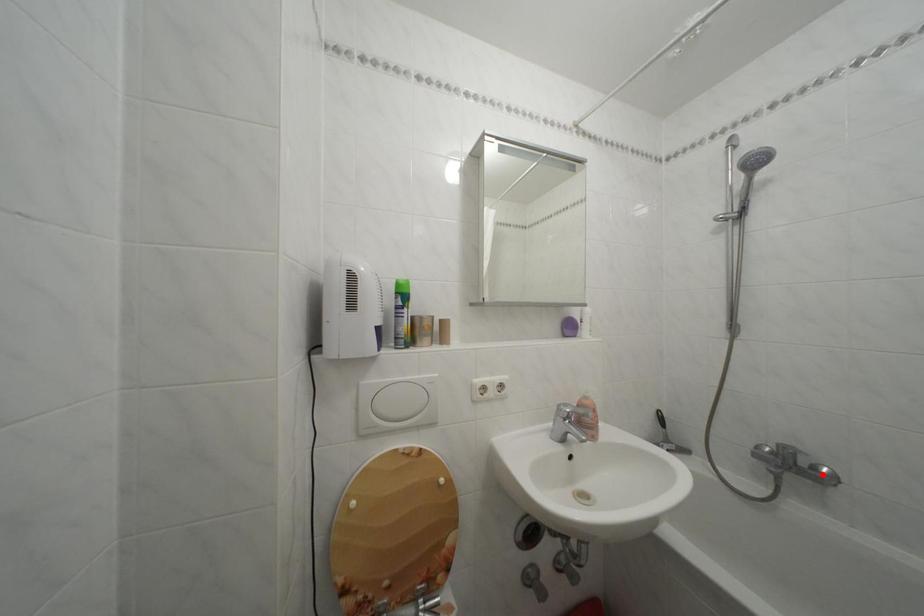
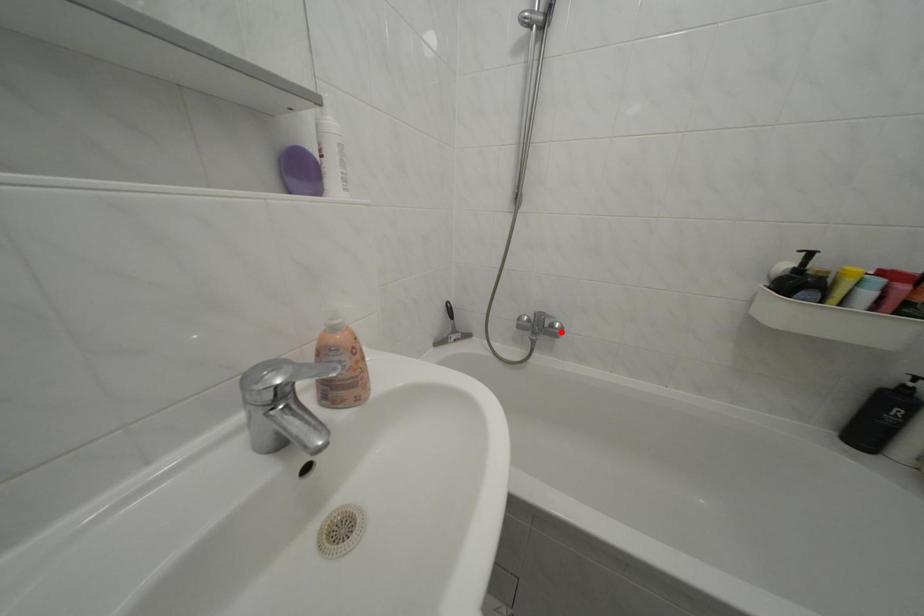
I am providing you with two images of the same scene from different viewpoints. A red point is marked on the first image and another point is marked on the second image. Are the points marked in image1 and image2 representing the same 3D position?

Yes